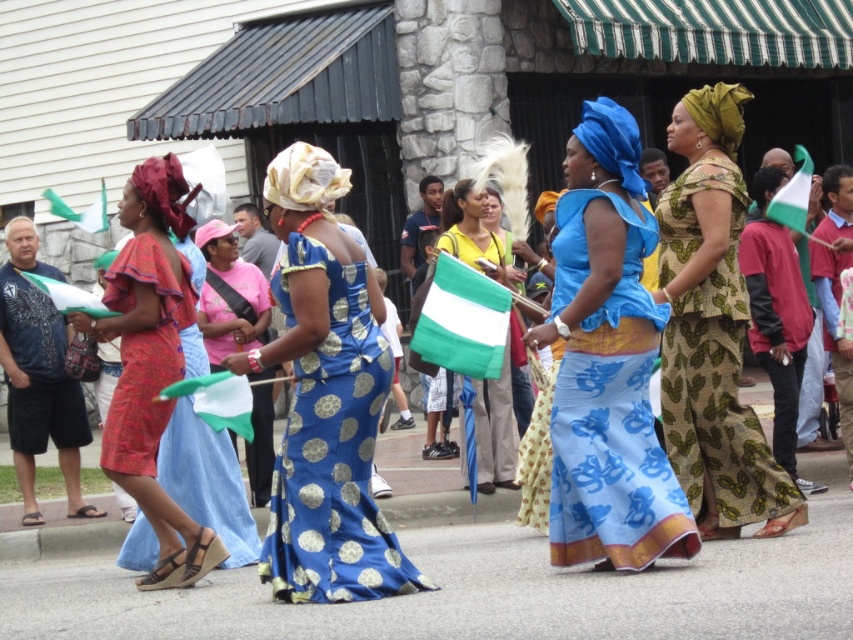
Which is in front, point (137, 328) or point (190, 445)?

Positioned in front is point (137, 328).

Is point (225, 550) positioned behind point (186, 397)?

That is False.

Find the location of a particular element. matte red dress at left is located at coordinates (154, 369).

Can you confirm if blue and gold fabric dress at center is shorter than green and white fabric flag at center?

Yes.

Can you confirm if blue and gold fabric dress at center is taller than green and white fabric flag at center?

Incorrect, blue and gold fabric dress at center's height is not larger of green and white fabric flag at center's.

I want to click on blue and gold fabric dress at center, so click(x=229, y=296).

Between blue printed dress at center and blue and gold fabric dress at center, which one appears on the left side from the viewer's perspective?

Positioned to the left is blue and gold fabric dress at center.

The height and width of the screenshot is (640, 853). Describe the element at coordinates (325, 397) in the screenshot. I see `blue printed dress at center` at that location.

Identify the location of blue printed dress at center. The height and width of the screenshot is (640, 853). (x=325, y=397).